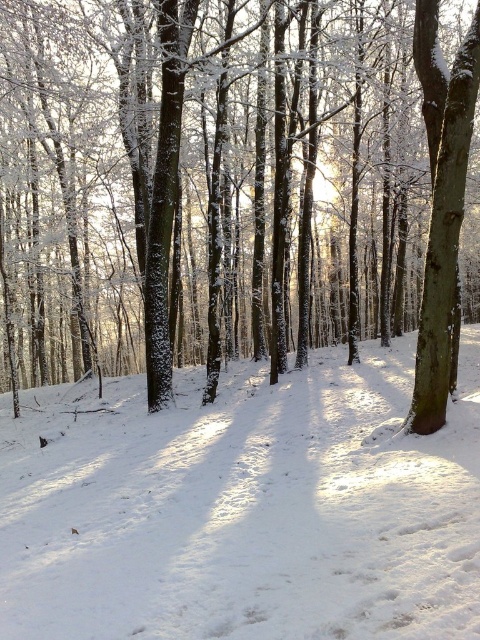
You are an animal trying to cross the forest floor. You see the white powdery snow at center and the smooth bark tree at right. Which surface can you walk on without sinking?

The smooth bark tree at right is above the white powdery snow at center, so walking on the smooth bark tree at right would prevent sinking into the snow.